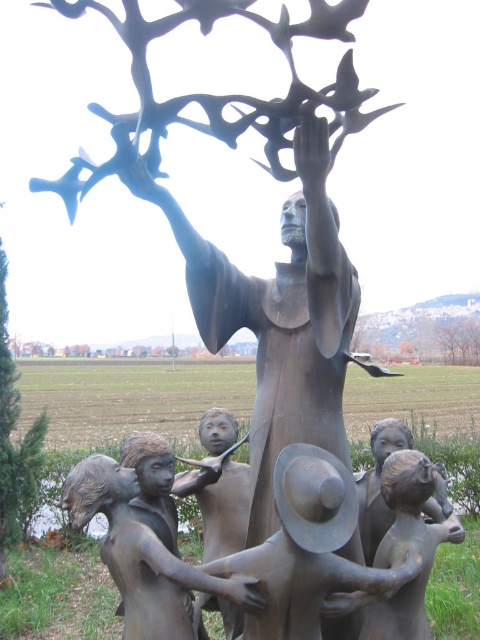
What is located at the coordinate point (x=420, y=333) in the image?

The green matte tree at upper center is located at point (x=420, y=333).

What object is located at the coordinates point (307, 547)?

The point (307, 547) corresponds to the brushed metal hat at lower center.

You are an artist standing in front of the bronze sculpture. You notice the brushed metal hat at lower center and the brown wood tree at upper center. Which object is positioned higher in the image?

The brown wood tree at upper center is positioned higher than the brushed metal hat at lower center.